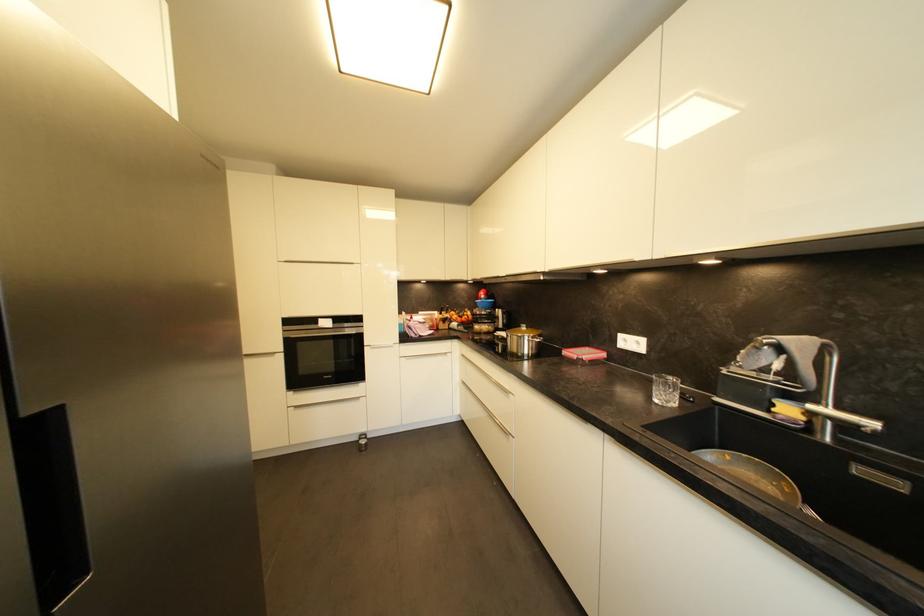
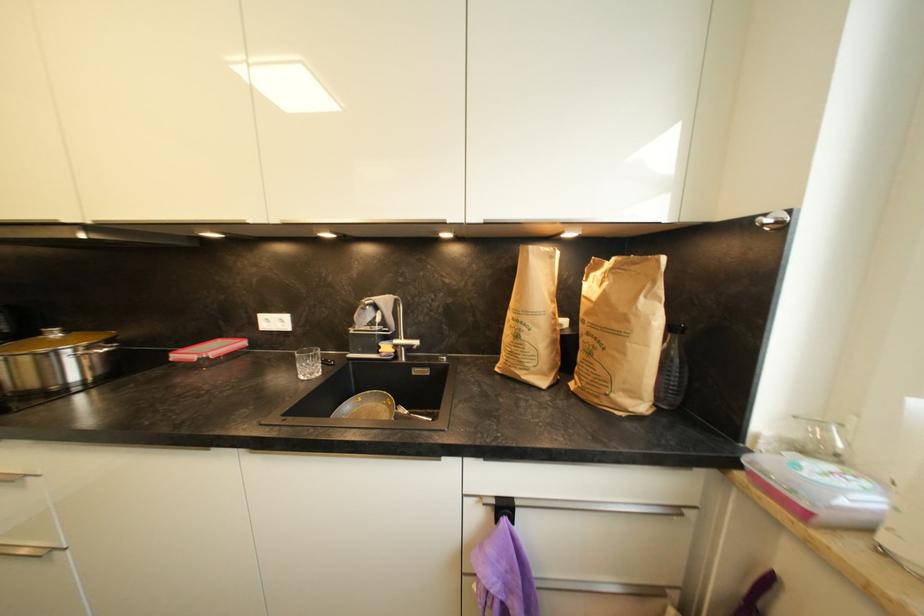
Question: The camera is either moving clockwise (left) or counter-clockwise (right) around the object. The first image is from the beginning of the video and the second image is from the end. Is the camera moving left or right when shooting the video?

Choices:
 (A) Left
 (B) Right

Answer: (A)